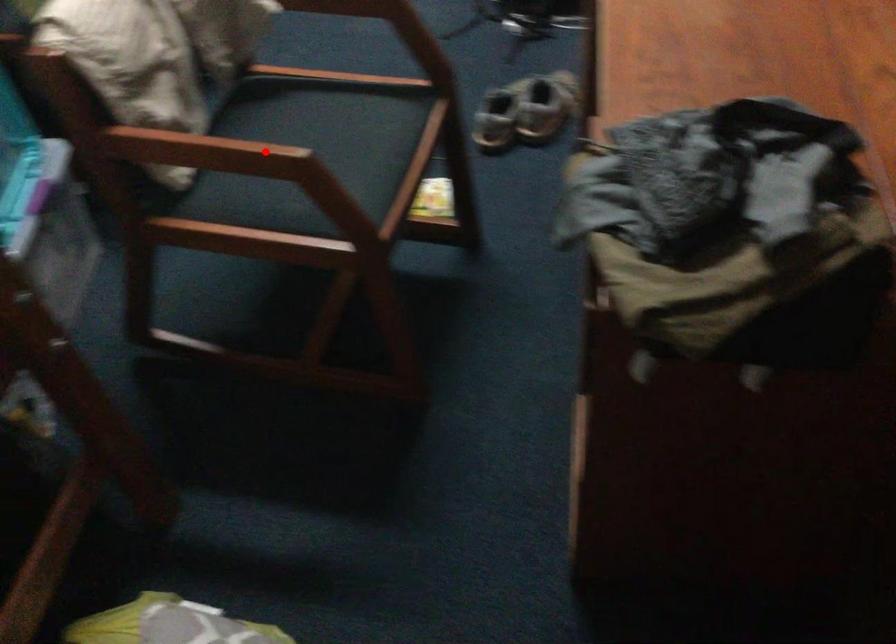
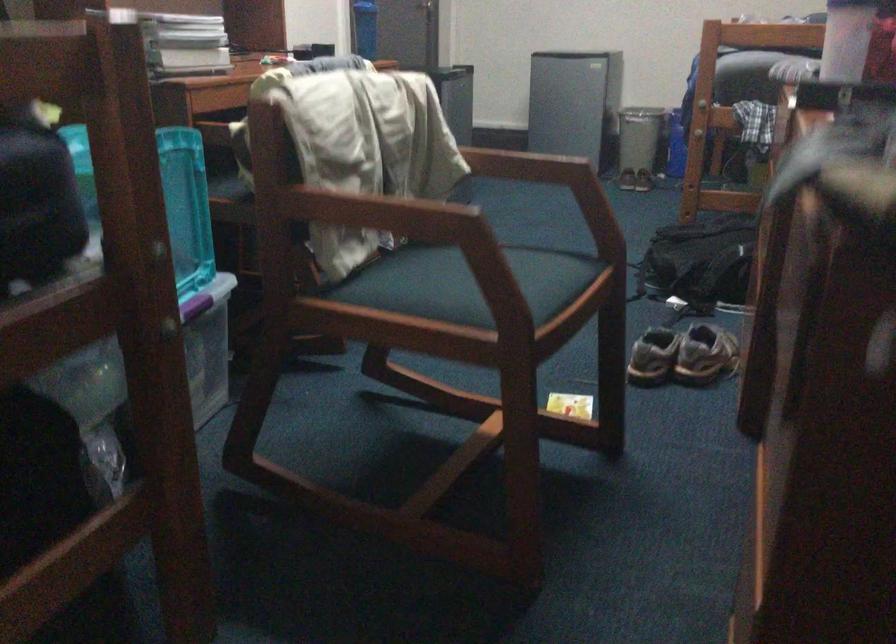
Locate, in the second image, the point that corresponds to the highlighted location in the first image.

(436, 210)